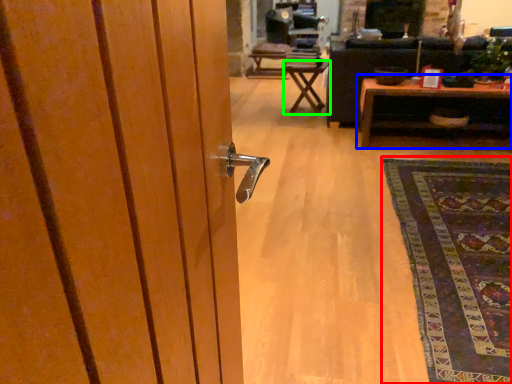
Question: Estimate the real-world distances between objects in this image. Which object is closer to mat (highlighted by a red box), table (highlighted by a blue box) or table (highlighted by a green box)?

Choices:
 (A) table
 (B) table

Answer: (A)